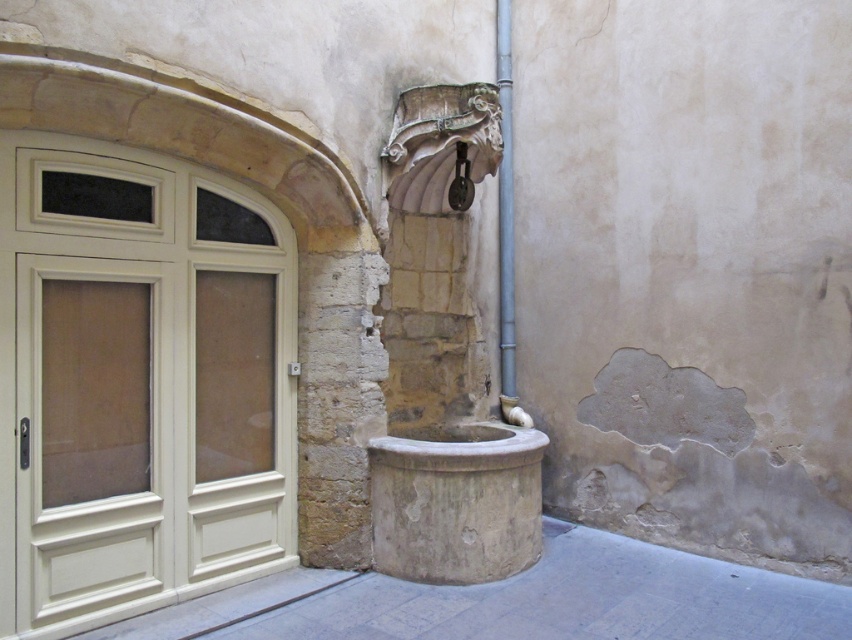
Who is more forward, (73, 273) or (499, 205)?

Point (73, 273) is more forward.

Is white painted wood screen door at left smaller than metallic pipe at center-right?

Incorrect, white painted wood screen door at left is not smaller in size than metallic pipe at center-right.

Who is more distant from viewer, (95, 381) or (499, 188)?

Positioned behind is point (499, 188).

Identify the location of white painted wood screen door at left. (137, 384).

Is white painted wood screen door at left smaller than white matte screen door at left?

No.

From the picture: Which is below, white painted wood screen door at left or white matte screen door at left?

white matte screen door at left is below.

Is point (269, 394) farther from camera compared to point (140, 522)?

Yes.

This screenshot has height=640, width=852. Find the location of `white painted wood screen door at left`. white painted wood screen door at left is located at coordinates (137, 384).

Between white matte screen door at left and metallic pipe at center-right, which one is positioned lower?

Positioned lower is white matte screen door at left.

Based on the photo, does white matte screen door at left have a lesser height compared to metallic pipe at center-right?

Yes.

You are a GUI agent. You are given a task and a screenshot of the screen. Output one action in this format:
    pyautogui.click(x=<x>, y=<y>)
    Task: Click on the white matte screen door at left
    This screenshot has height=640, width=852.
    Given the screenshot: What is the action you would take?
    pyautogui.click(x=95, y=499)